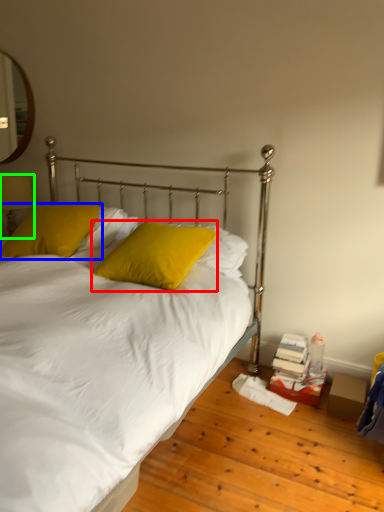
Question: Which object is the closest to the pillow (highlighted by a red box)? Choose among these: pillow (highlighted by a blue box) or table lamp (highlighted by a green box).

Choices:
 (A) pillow
 (B) table lamp

Answer: (A)